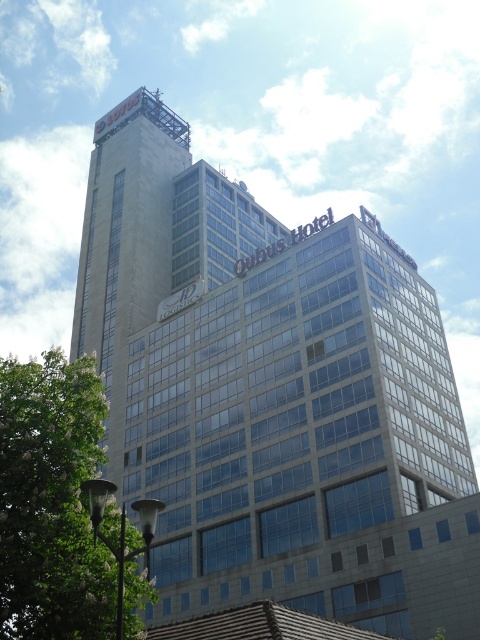
You are standing in front of the gray concrete building at center and want to take a photo of the silver metallic lamp post at lower left. Since the building is between you and the lamp post, will the building block your view of the lamp post?

The gray concrete building at center is further to the viewer than the silver metallic lamp post at lower left. Therefore, the building is closer to you, so it will block your view of the silver metallic lamp post at lower left.

You are standing in front of the building and want to take a photo of the gray concrete building at center without any obstructions. Is the green leafy tree at lower left blocking your view?

The green leafy tree at lower left is behind the gray concrete building at center, so it won